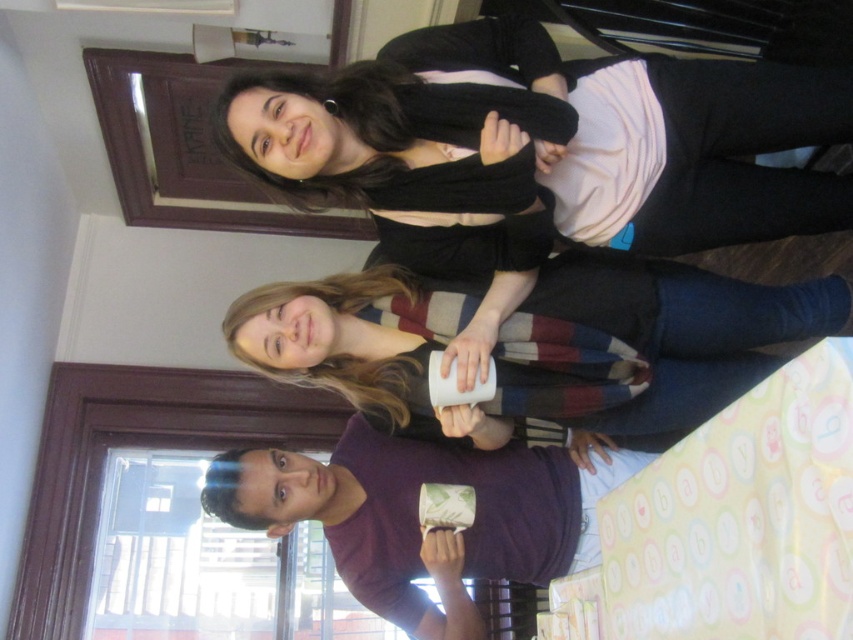
Is black matte sweater at upper center to the left of matte green fabric mug at lower center from the viewer's perspective?

No, black matte sweater at upper center is not to the left of matte green fabric mug at lower center.

Is black matte sweater at upper center to the right of matte green fabric mug at lower center from the viewer's perspective?

Correct, you'll find black matte sweater at upper center to the right of matte green fabric mug at lower center.

The width and height of the screenshot is (853, 640). Identify the location of black matte sweater at upper center. (735, 154).

How far apart are white matte mug at center and black matte sweater at upper center?

white matte mug at center is 13.41 inches away from black matte sweater at upper center.

Who is shorter, white matte mug at center or black matte sweater at upper center?

Standing shorter between the two is white matte mug at center.

Between point (392, 406) and point (732, 61), which one is positioned behind?

Point (392, 406)

Find the location of a particular element. white matte mug at center is located at coordinates (659, 355).

Does white matte mug at center have a greater width compared to matte green fabric mug at lower center?

Yes.

Between point (695, 419) and point (415, 564), which one is positioned behind?

Positioned behind is point (415, 564).

Identify the location of white matte mug at center. This screenshot has height=640, width=853. (659, 355).

Image resolution: width=853 pixels, height=640 pixels. I want to click on white matte mug at center, so click(659, 355).